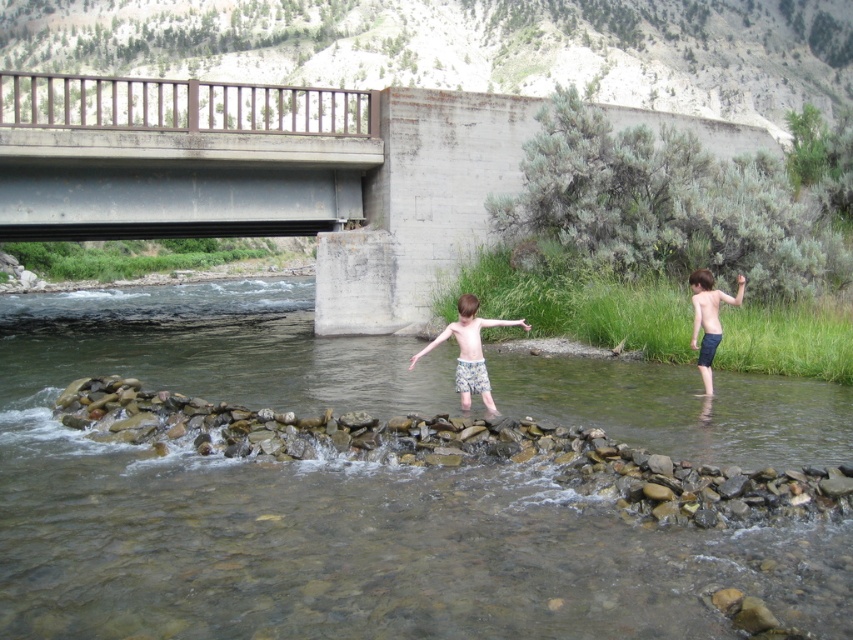
Question: Which object is positioned farthest from the clear water at center?

Choices:
 (A) dark blue shorts at right
 (B) light blue shorts at center
 (C) metallic gray bridge at upper center

Answer: (C)

Question: Which point appears closest to the camera in this image?

Choices:
 (A) (479, 349)
 (B) (670, 614)
 (C) (12, 182)
 (D) (700, 310)

Answer: (B)

Question: Is clear water at center to the left of dark blue shorts at right from the viewer's perspective?

Choices:
 (A) yes
 (B) no

Answer: (A)

Question: Can you confirm if metallic gray bridge at upper center is smaller than dark blue shorts at right?

Choices:
 (A) no
 (B) yes

Answer: (A)

Question: Is clear water at center above metallic gray bridge at upper center?

Choices:
 (A) yes
 (B) no

Answer: (B)

Question: Which is nearer to the clear water at center?

Choices:
 (A) dark blue shorts at right
 (B) light blue shorts at center

Answer: (B)